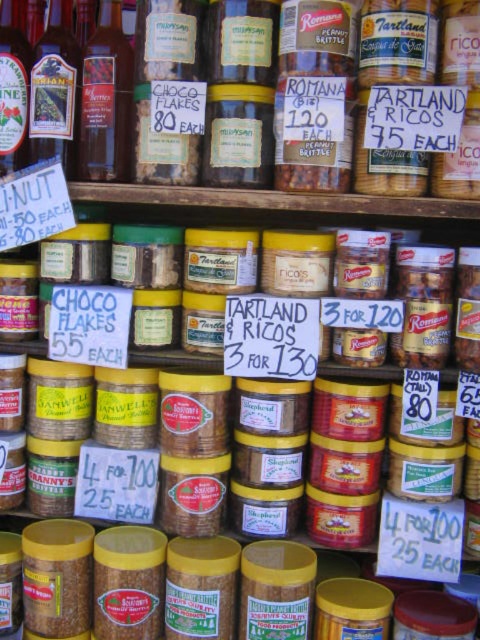
Question: Which is farther from the matte glass bottle at upper left?

Choices:
 (A) translucent glass bottle at center
 (B) translucent glass bottle at upper left

Answer: (B)

Question: Does translucent glass bottle at upper left appear on the right side of matte glass bottle at upper left?

Choices:
 (A) yes
 (B) no

Answer: (A)

Question: In this image, where is matte glass bottle at upper left located relative to translucent glass bottle at center?

Choices:
 (A) below
 (B) above

Answer: (A)

Question: Which object is the closest to the translucent glass bottle at upper left?

Choices:
 (A) matte glass bottle at upper left
 (B) translucent glass bottle at center

Answer: (A)

Question: Does matte glass bottle at upper left have a smaller size compared to translucent glass bottle at center?

Choices:
 (A) yes
 (B) no

Answer: (B)

Question: Estimate the real-world distances between objects in this image. Which object is closer to the matte glass bottle at upper left?

Choices:
 (A) translucent glass bottle at center
 (B) translucent glass bottle at upper left

Answer: (A)